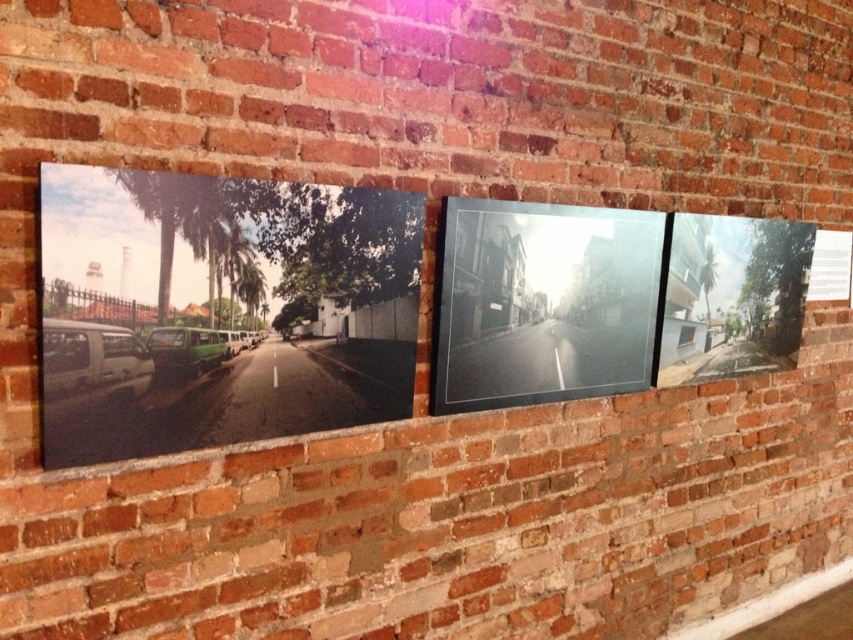
You are an interior designer arranging a gallery wall. You have two items to place next to each other on the wall. The matte canvas print at left and the transparent glass picture frame at center. Which one requires more wall space?

The transparent glass picture frame at center requires more wall space because it occupies more space than the matte canvas print at left.